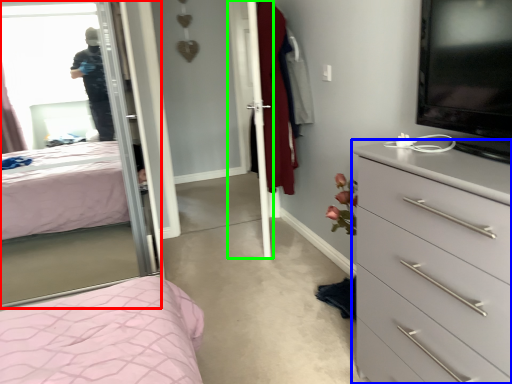
Question: Which is nearer to the mirror (highlighted by a red box)? chest of drawers (highlighted by a blue box) or screen door (highlighted by a green box).

Choices:
 (A) chest of drawers
 (B) screen door

Answer: (A)